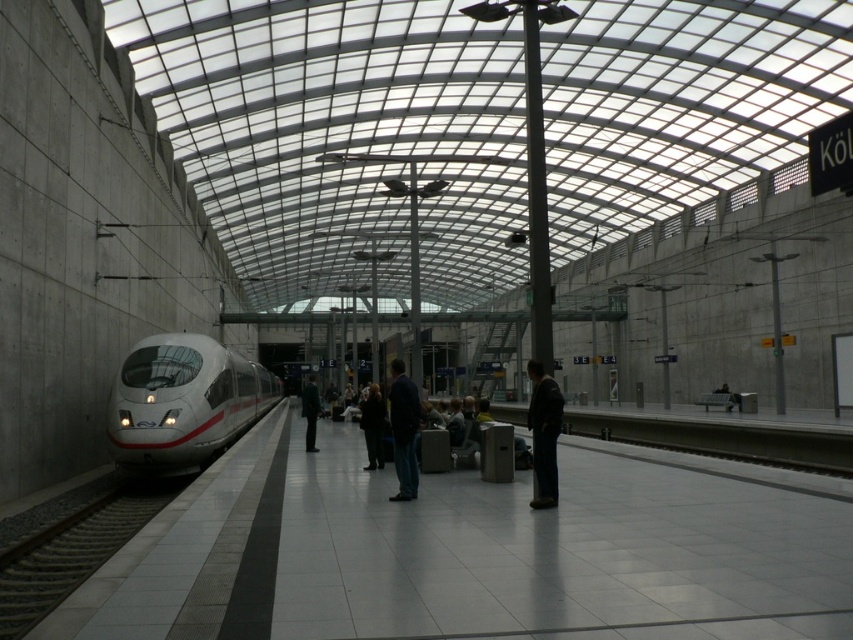
You are a traveler standing on the platform waiting for your train. You notice two items left on the platform floor at center. The blue denim jeans at center and the dark brown leather jacket at center. Which item is taller?

The dark brown leather jacket at center is taller than the blue denim jeans at center.

You are a photographer standing on the platform at the train station. You want to take a photo of the gray gravel train track at lower left and the dark blue jeans at center. Which object will appear larger in your photo?

The gray gravel train track at lower left will appear larger in the photo because it is bigger than the dark blue jeans at center.